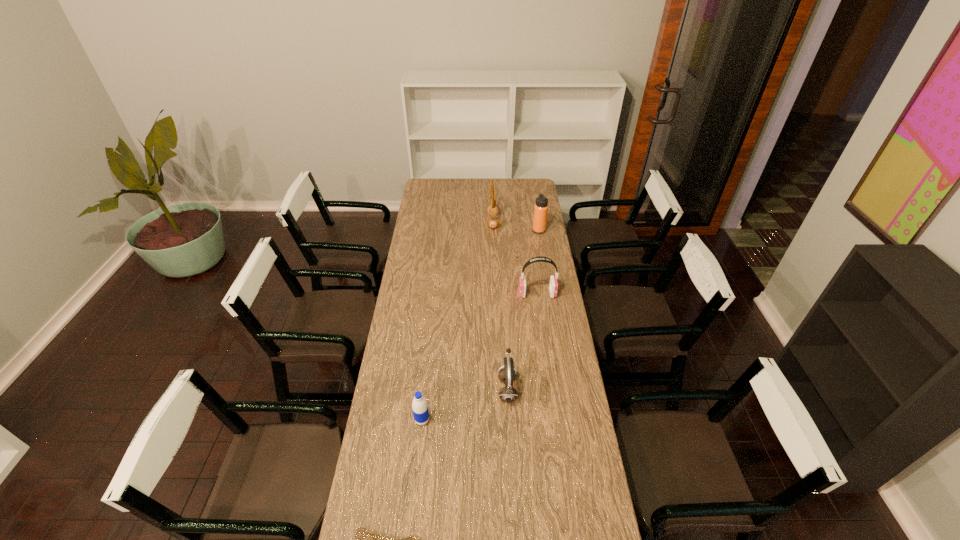
In order to click on the farthest earphone in this screenshot , I will do `click(492, 209)`.

Where is `thermos bottle`? thermos bottle is located at coordinates (541, 207).

This screenshot has height=540, width=960. Identify the location of the second nearest earphone. (553, 285).

Where is `the third farthest object`? the third farthest object is located at coordinates (553, 285).

Where is `the nearest earphone`? the nearest earphone is located at coordinates (506, 375).

Where is `water bottle`? This screenshot has width=960, height=540. water bottle is located at coordinates pyautogui.click(x=419, y=405).

Find the location of a particular element. Image resolution: width=960 pixels, height=540 pixels. the second shortest object is located at coordinates tap(419, 405).

Where is `vacant area located on the front-facing side of the farthest earphone`? vacant area located on the front-facing side of the farthest earphone is located at coordinates (438, 222).

Locate an element on the screen. This screenshot has width=960, height=540. vacant area situated on the front-facing side of the farthest earphone is located at coordinates (440, 222).

Where is `vacant space located 0.140m on the front-facing side of the farthest earphone`? Image resolution: width=960 pixels, height=540 pixels. vacant space located 0.140m on the front-facing side of the farthest earphone is located at coordinates (462, 222).